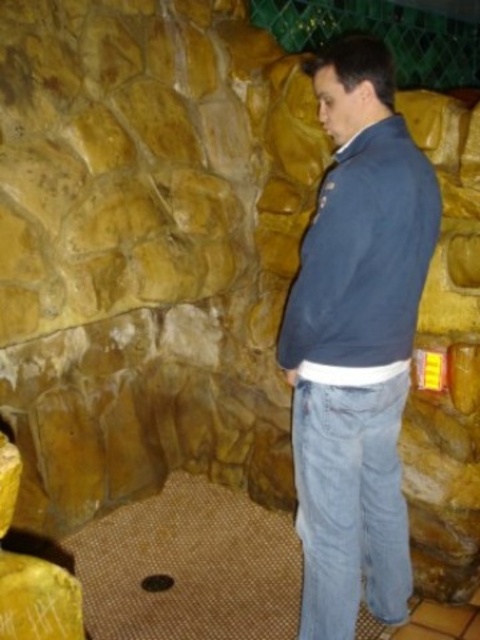
You are a delivery robot with a package that is 3 inches wide. You need to navigate through the space between the blue denim jeans at center and the blue fleece sweatshirt at right. Can your package fit through this space?

The distance between the blue denim jeans at center and the blue fleece sweatshirt at right is 3.16 inches, so the 3 inch wide package can fit through the space.

You are a fashion designer analyzing the man in the image. You need to determine if the blue denim jeans at center can be paired with the blue fleece sweatshirt at right based on their widths. Which one is narrower?

The blue denim jeans at center is narrower than the blue fleece sweatshirt at right because its width is less than the sweatshirt.